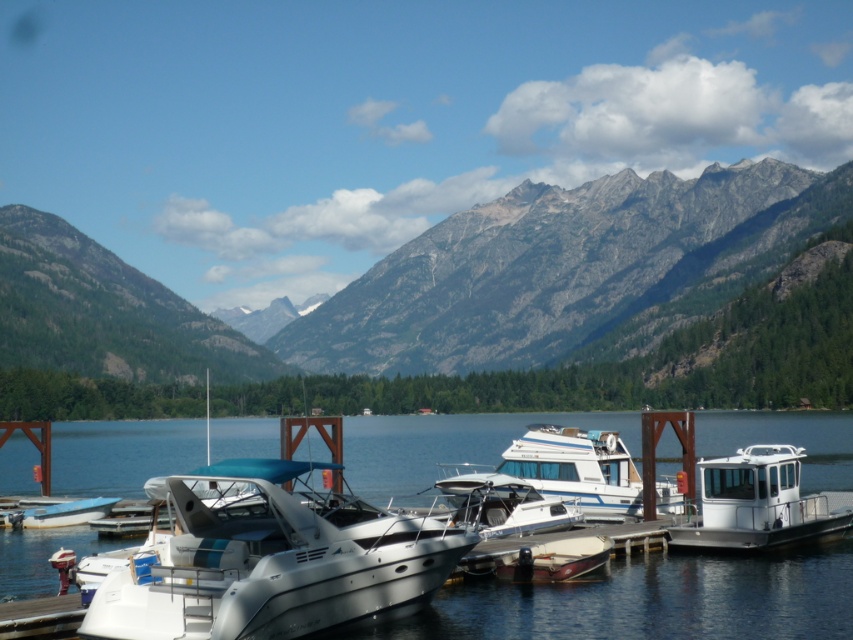
Question: Is gray rocky mountain at left bigger than white glossy boat at lower left?

Choices:
 (A) no
 (B) yes

Answer: (B)

Question: Does green textured mountain at left have a greater width compared to shiny brown boat at center?

Choices:
 (A) no
 (B) yes

Answer: (B)

Question: Which object is farther from the camera taking this photo?

Choices:
 (A) white glossy boat at lower left
 (B) white glossy boat at center
 (C) gray rocky mountain at left

Answer: (C)

Question: Which object appears closest to the camera in this image?

Choices:
 (A) shiny brown boat at center
 (B) white glossy boat at lower left
 (C) gray rocky mountain at left
 (D) white glossy boat at center

Answer: (A)

Question: Is green textured mountain at left wider than white glossy houseboat at center?

Choices:
 (A) yes
 (B) no

Answer: (A)

Question: Which object is farther from the camera taking this photo?

Choices:
 (A) white glossy houseboat at center
 (B) gray rocky mountain at left
 (C) white glossy boat at center
 (D) silver metallic boat at center

Answer: (B)